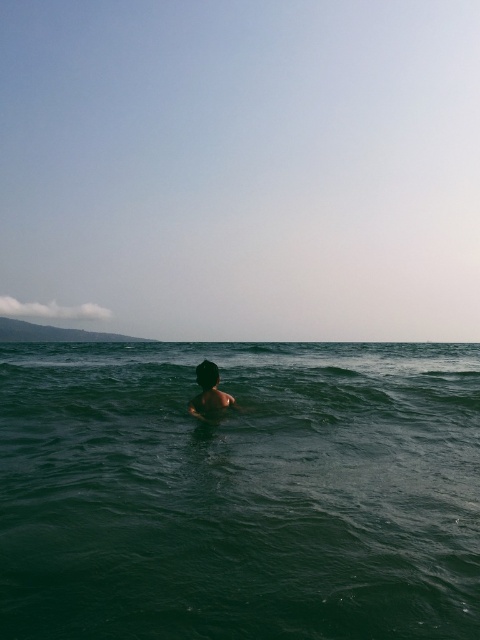
Question: Is green liquid water at center smaller than dark brown hair at center?

Choices:
 (A) yes
 (B) no

Answer: (B)

Question: Can you confirm if green liquid water at center is thinner than dark brown hair at center?

Choices:
 (A) yes
 (B) no

Answer: (B)

Question: Can you confirm if green liquid water at center is smaller than dark brown hair at center?

Choices:
 (A) yes
 (B) no

Answer: (B)

Question: Among these points, which one is nearest to the camera?

Choices:
 (A) [179, 492]
 (B) [204, 419]

Answer: (A)